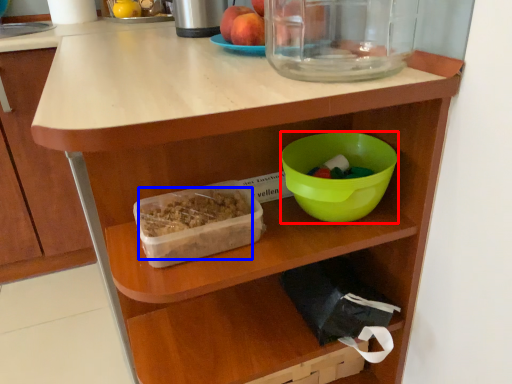
Question: Which of the following is the closest to the observer, bowl (highlighted by a red box) or food (highlighted by a blue box)?

Choices:
 (A) bowl
 (B) food

Answer: (B)